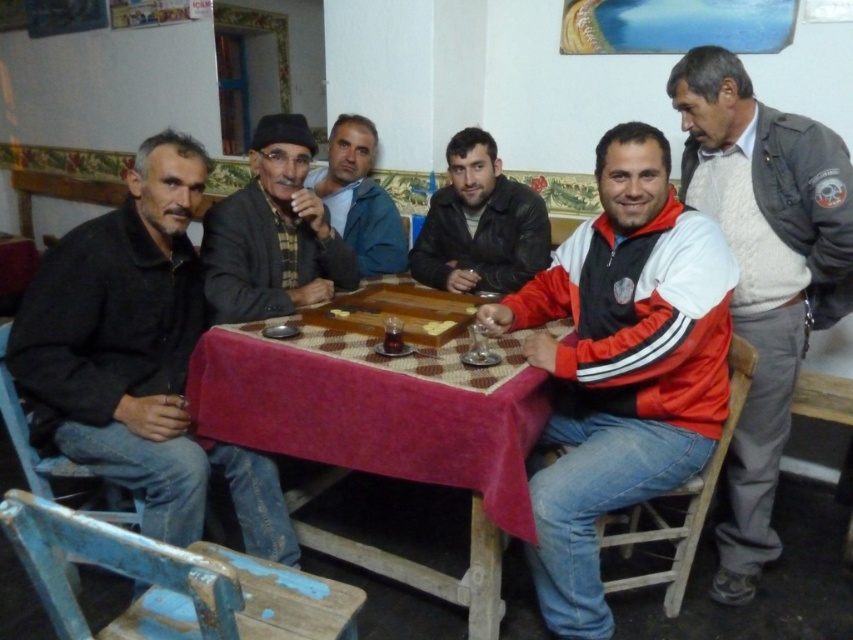
In the scene described, there are a gray wool sweater at upper right and a dark blue fabric at center. From the perspective of someone standing at the table, which object is positioned to the right of the other?

The gray wool sweater at upper right is to the right of the dark blue fabric at center.

You are a photographer trying to capture a closeup of the dark gray knit cap at center without including the black matte jacket at left in the frame. Given their positions and sizes, is this possible?

The black matte jacket at left is taller than the dark gray knit cap at center, so it might block the view. However, since the jacket is to the left and the cap is at the center, moving the camera slightly to the right could allow focusing on the cap without the jacket in the frame.

Looking at this image, you are a guest at this gathering and want to sit down at the table. There is a gray wool sweater at upper right and a dark blue fabric at center. Which object is closer to the table surface?

The gray wool sweater at upper right is below the dark blue fabric at center, so the gray wool sweater at upper right is closer to the table surface.